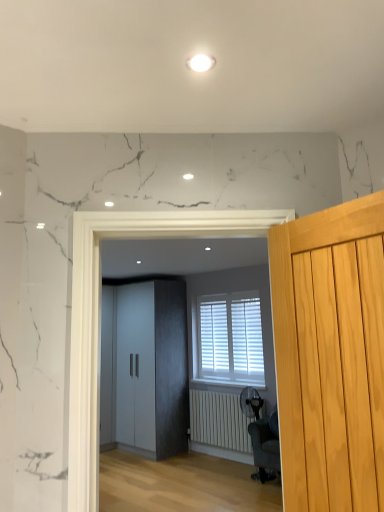
What are the coordinates of `dark gray fabric swivel chair at center` in the screenshot? It's located at (261, 438).

Locate an element on the screen. matte gray wardrobe at center is located at coordinates (100, 311).

In order to face matte gray wardrobe at center, should I rotate leftwards or rightwards?

To align with it, rotate right about 0.037°.

Describe the element at coordinates (145, 368) in the screenshot. The width and height of the screenshot is (384, 512). I see `white matte cabinet at center` at that location.

Locate an element on the screen. The width and height of the screenshot is (384, 512). white matte blinds at center is located at coordinates (228, 339).

In order to click on white matte radiator at lower center in this screenshot , I will do `click(219, 421)`.

Which of these two, white matte cabinet at center or white matte radiator at lower center, stands taller?

white matte cabinet at center.

Identify the location of elevator behind the white matte radiator at lower center. (145, 368).

Which object is wider, white matte cabinet at center or white matte radiator at lower center?

white matte cabinet at center is wider.

Can we say white matte cabinet at center lies outside white matte radiator at lower center?

Yes, white matte cabinet at center is not within white matte radiator at lower center.

Is light wood door at right in front of or behind matte gray wardrobe at center in the image?

Visually, light wood door at right is located in front of matte gray wardrobe at center.

Which is nearer, (297, 252) or (75, 219)?

Point (297, 252)

Could you tell me if light wood door at right is facing matte gray wardrobe at center?

No, light wood door at right is not oriented towards matte gray wardrobe at center.

Do you think white matte radiator at lower center is within white matte cabinet at center, or outside of it?

white matte radiator at lower center is not enclosed by white matte cabinet at center.

Is white matte radiator at lower center aimed at white matte cabinet at center?

No.

Between white matte radiator at lower center and white matte cabinet at center, which one appears on the right side from the viewer's perspective?

white matte radiator at lower center is more to the right.

Does white matte blinds at center turn towards matte gray wardrobe at center?

No.

Is white matte blinds at center at the right side of matte gray wardrobe at center?

Indeed, white matte blinds at center is positioned on the right side of matte gray wardrobe at center.

Can you see white matte blinds at center touching matte gray wardrobe at center?

No.

Between white matte blinds at center and matte gray wardrobe at center, which one has more height?

Standing taller between the two is white matte blinds at center.

From the picture: Does white matte blinds at center have a lesser width compared to light wood door at right?

No, white matte blinds at center is not thinner than light wood door at right.

Would you say white matte blinds at center is a long distance from light wood door at right?

white matte blinds at center is positioned a significant distance from light wood door at right.

Consider the image. Is white matte blinds at center positioned beyond the bounds of light wood door at right?

Answer: Yes, white matte blinds at center is outside of light wood door at right.

Could you tell me if light wood door at right is facing white matte radiator at lower center?

No.

In the image, there is a light wood door at right. Identify the location of radiator below it (from a real-world perspective). The height and width of the screenshot is (512, 384). (219, 421).

Who is bigger, light wood door at right or white matte radiator at lower center?

white matte radiator at lower center.

Looking at this image, can you tell me how much light wood door at right and dark gray fabric swivel chair at center differ in facing direction?

They differ by 19.8 degrees in their facing directions.

Between point (357, 432) and point (252, 423), which one is positioned behind?

The point (252, 423) is farther from the camera.

From the image's perspective, between light wood door at right and dark gray fabric swivel chair at center, who is located below?

dark gray fabric swivel chair at center appears lower in the image.

Would you say light wood door at right is inside or outside dark gray fabric swivel chair at center?

light wood door at right is outside dark gray fabric swivel chair at center.

Image resolution: width=384 pixels, height=512 pixels. What are the coordinates of `elevator behind the white matte radiator at lower center` in the screenshot? It's located at (145, 368).

Locate an element on the screen. corridor on the left of light wood door at right is located at coordinates (100, 311).

From the image, which object appears to be nearer to dark gray fabric swivel chair at center, white matte cabinet at center or white matte blinds at center?

white matte blinds at center is positioned closer to the anchor dark gray fabric swivel chair at center.

Looking at the image, which one is located closer to matte gray wardrobe at center, dark gray fabric swivel chair at center or white matte radiator at lower center?

dark gray fabric swivel chair at center is closer to matte gray wardrobe at center.

Based on their spatial positions, is white matte cabinet at center or light wood door at right further from dark gray fabric swivel chair at center?

light wood door at right.

Which object lies further to the anchor point light wood door at right, white matte cabinet at center or dark gray fabric swivel chair at center?

white matte cabinet at center lies further to light wood door at right than the other object.

When comparing their distances from dark gray fabric swivel chair at center, does white matte cabinet at center or matte gray wardrobe at center seem further?

matte gray wardrobe at center is positioned further to the anchor dark gray fabric swivel chair at center.

Based on the photo, from the image, which object appears to be farther from matte gray wardrobe at center, white matte radiator at lower center or light wood door at right?

Among the two, white matte radiator at lower center is located further to matte gray wardrobe at center.

Based on their spatial positions, is white matte blinds at center or white matte cabinet at center closer to light wood door at right?

The object closer to light wood door at right is white matte blinds at center.

Which object lies nearer to the anchor point white matte cabinet at center, matte gray wardrobe at center or light wood door at right?

matte gray wardrobe at center.

Find the location of a particular element. Image resolution: width=384 pixels, height=512 pixels. radiator between white matte cabinet at center and white matte blinds at center is located at coordinates tap(219, 421).

Where is `radiator between white matte cabinet at center and dark gray fabric swivel chair at center in the horizontal direction`? Image resolution: width=384 pixels, height=512 pixels. radiator between white matte cabinet at center and dark gray fabric swivel chair at center in the horizontal direction is located at coordinates (219, 421).

In order to click on swivel chair between white matte blinds at center and white matte radiator at lower center in the up-down direction in this screenshot , I will do `click(261, 438)`.

Find the location of a particular element. This screenshot has width=384, height=512. swivel chair positioned between matte gray wardrobe at center and white matte radiator at lower center from near to far is located at coordinates (261, 438).